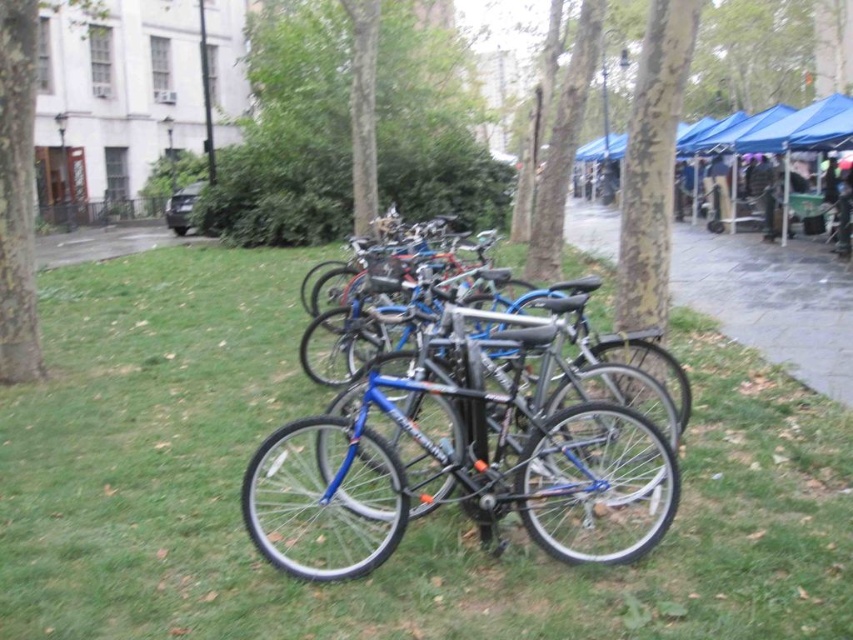
Is green grass at center bigger than blue metallic bicycle at center?

Correct, green grass at center is larger in size than blue metallic bicycle at center.

Describe the element at coordinates (410, 524) in the screenshot. The image size is (853, 640). I see `green grass at center` at that location.

Where is `green grass at center`? green grass at center is located at coordinates (410, 524).

Which is in front, point (610, 257) or point (20, 356)?

Point (20, 356) is in front.

Is gray concrete pavement at center thinner than brown rough tree at upper left?

Indeed, gray concrete pavement at center has a lesser width compared to brown rough tree at upper left.

Locate an element on the screen. Image resolution: width=853 pixels, height=640 pixels. gray concrete pavement at center is located at coordinates (770, 300).

The height and width of the screenshot is (640, 853). I want to click on gray concrete pavement at center, so click(x=770, y=300).

Is the position of blue metallic bicycle at center less distant than that of smooth bark tree at center?

Yes, blue metallic bicycle at center is closer to the viewer.

From the picture: Is blue metallic bicycle at center further to the viewer compared to smooth bark tree at center?

That is False.

This screenshot has width=853, height=640. Find the location of `blue metallic bicycle at center`. blue metallic bicycle at center is located at coordinates (461, 460).